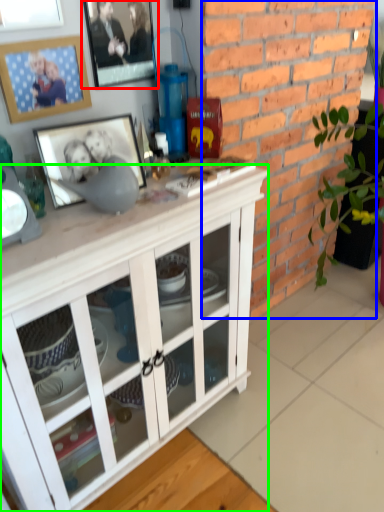
Question: Which is farther away from picture frame (highlighted by a red box)? brickwork (highlighted by a blue box) or cabinetry (highlighted by a green box)?

Choices:
 (A) brickwork
 (B) cabinetry

Answer: (B)